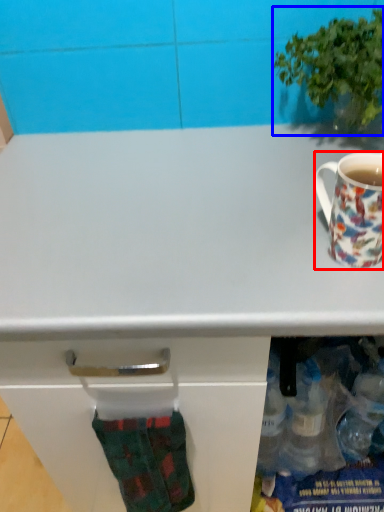
Question: Which object appears farthest to the camera in this image, coffee cup (highlighted by a red box) or houseplant (highlighted by a blue box)?

Choices:
 (A) coffee cup
 (B) houseplant

Answer: (B)